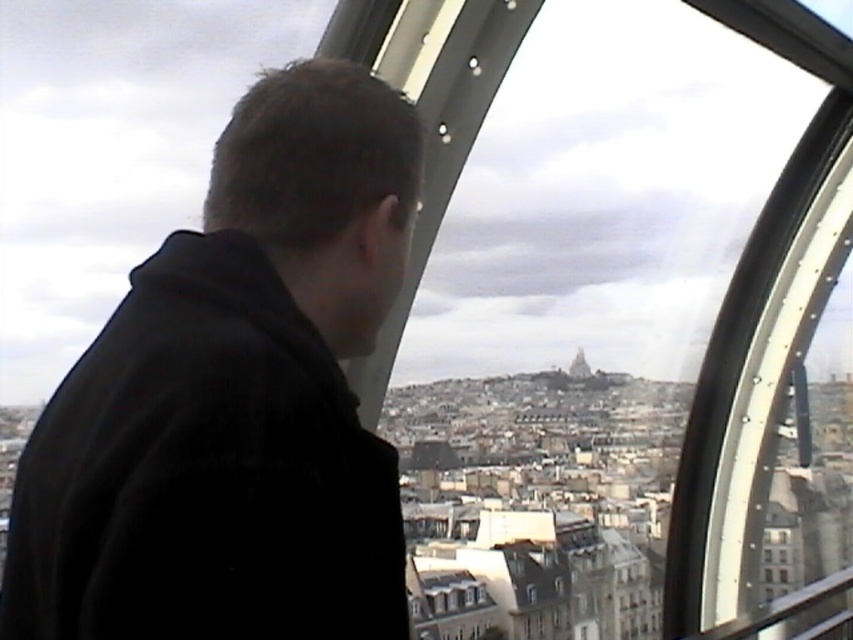
Question: Among these points, which one is farthest from the camera?

Choices:
 (A) (525, 596)
 (B) (578, 356)
 (C) (260, 593)

Answer: (B)

Question: Which of the following is the closest to the observer?

Choices:
 (A) black matte jacket at left
 (B) transparent glass window at center
 (C) smooth stone tower at center

Answer: (A)

Question: Can you confirm if black matte jacket at left is smaller than smooth stone tower at center?

Choices:
 (A) yes
 (B) no

Answer: (B)

Question: From the image, what is the correct spatial relationship of black matte jacket at left in relation to transparent glass window at center?

Choices:
 (A) left
 (B) right

Answer: (A)

Question: In this image, where is black matte jacket at left located relative to transparent glass window at center?

Choices:
 (A) left
 (B) right

Answer: (A)

Question: Which object appears farthest from the camera in this image?

Choices:
 (A) smooth stone tower at center
 (B) black matte jacket at left
 (C) transparent glass window at center

Answer: (A)